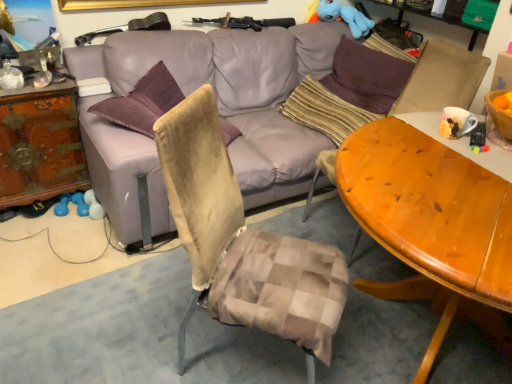
Question: From a real-world perspective, is purple leather couch at center beneath wooden carved dresser at left?

Choices:
 (A) no
 (B) yes

Answer: (A)

Question: Is the position of purple leather couch at center more distant than that of wooden carved dresser at left?

Choices:
 (A) yes
 (B) no

Answer: (B)

Question: Is purple leather couch at center facing towards wooden carved dresser at left?

Choices:
 (A) no
 (B) yes

Answer: (A)

Question: Is wooden carved dresser at left at the back of purple leather couch at center?

Choices:
 (A) no
 (B) yes

Answer: (A)

Question: Would you say wooden carved dresser at left is part of purple leather couch at center's contents?

Choices:
 (A) yes
 (B) no

Answer: (B)

Question: From the image's perspective, is purple leather couch at center above wooden carved dresser at left?

Choices:
 (A) yes
 (B) no

Answer: (A)

Question: Is matte ceramic mug at upper right inside purple leather couch at center?

Choices:
 (A) no
 (B) yes

Answer: (A)

Question: Does purple leather couch at center have a greater width compared to matte ceramic mug at upper right?

Choices:
 (A) yes
 (B) no

Answer: (A)

Question: Does purple leather couch at center turn towards matte ceramic mug at upper right?

Choices:
 (A) yes
 (B) no

Answer: (A)

Question: Is there a large distance between purple leather couch at center and matte ceramic mug at upper right?

Choices:
 (A) yes
 (B) no

Answer: (A)

Question: Considering the relative sizes of purple leather couch at center and matte ceramic mug at upper right in the image provided, is purple leather couch at center smaller than matte ceramic mug at upper right?

Choices:
 (A) no
 (B) yes

Answer: (A)

Question: Is matte ceramic mug at upper right at the back of purple leather couch at center?

Choices:
 (A) no
 (B) yes

Answer: (A)

Question: Does brown fabric swivel chair at right come in front of wooden table at center?

Choices:
 (A) yes
 (B) no

Answer: (B)